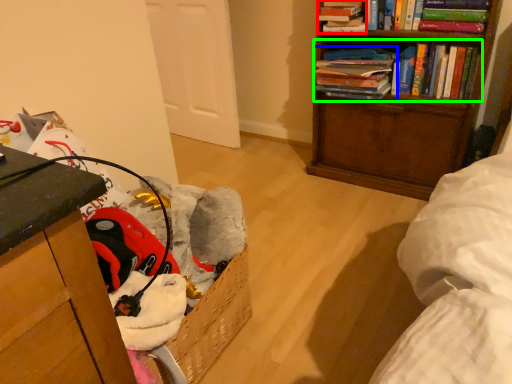
Question: Based on their relative distances, which object is farther from book (highlighted by a red box)? Choose from book (highlighted by a blue box) and book (highlighted by a green box).

Choices:
 (A) book
 (B) book

Answer: (B)